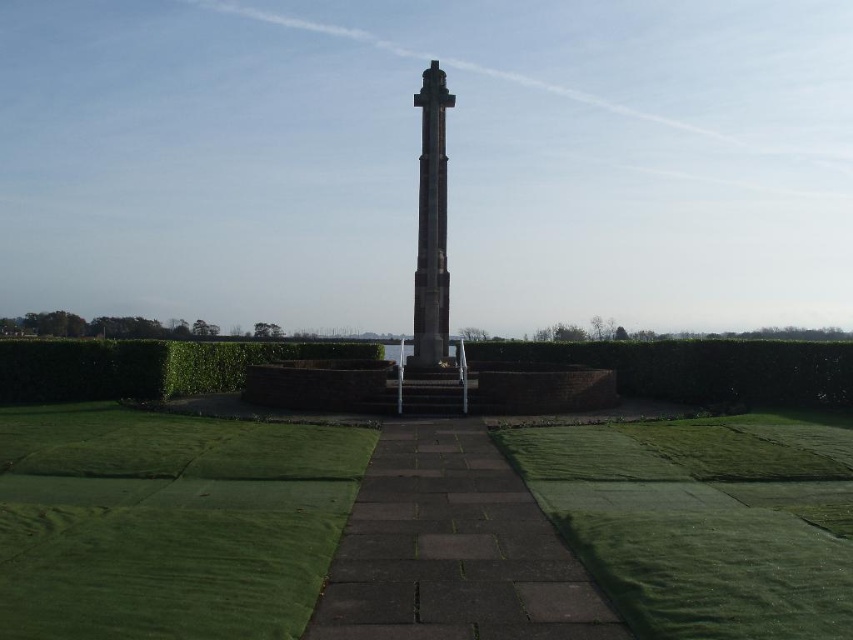
You are a gardener planning to mow the lawn. You see the green grass at lower left and the green turf at lower right. Which area requires more time to mow based on their widths?

The green grass at lower left might be wider than green turf at lower right, so it could take more time to mow the green grass at lower left.